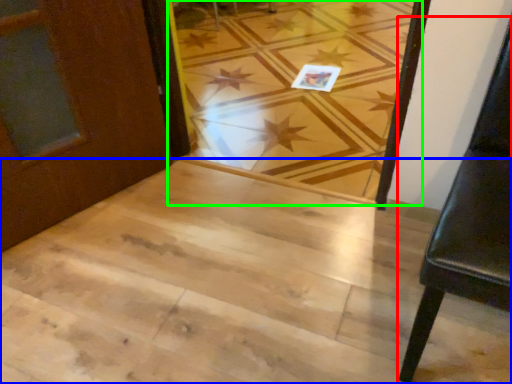
Question: Based on their relative distances, which object is nearer to furniture (highlighted by a red box)? Choose from stairwell (highlighted by a blue box) and plank (highlighted by a green box).

Choices:
 (A) stairwell
 (B) plank

Answer: (A)